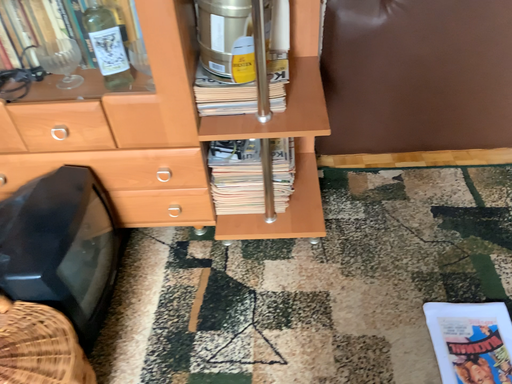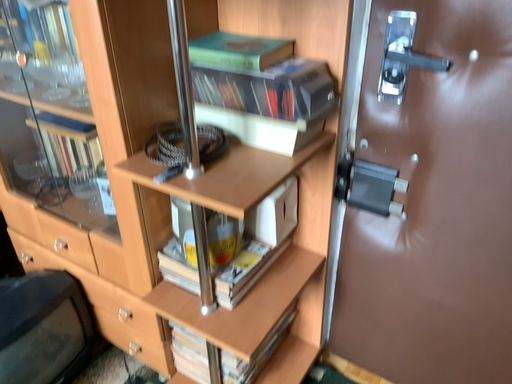
Question: How did the camera likely rotate when shooting the video?

Choices:
 (A) rotated left
 (B) rotated right

Answer: (A)